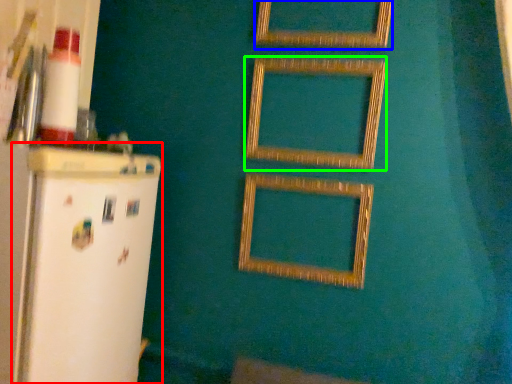
Question: Based on their relative distances, which object is nearer to fridge (highlighted by a red box)? Choose from picture frame (highlighted by a blue box) and picture frame (highlighted by a green box).

Choices:
 (A) picture frame
 (B) picture frame

Answer: (B)